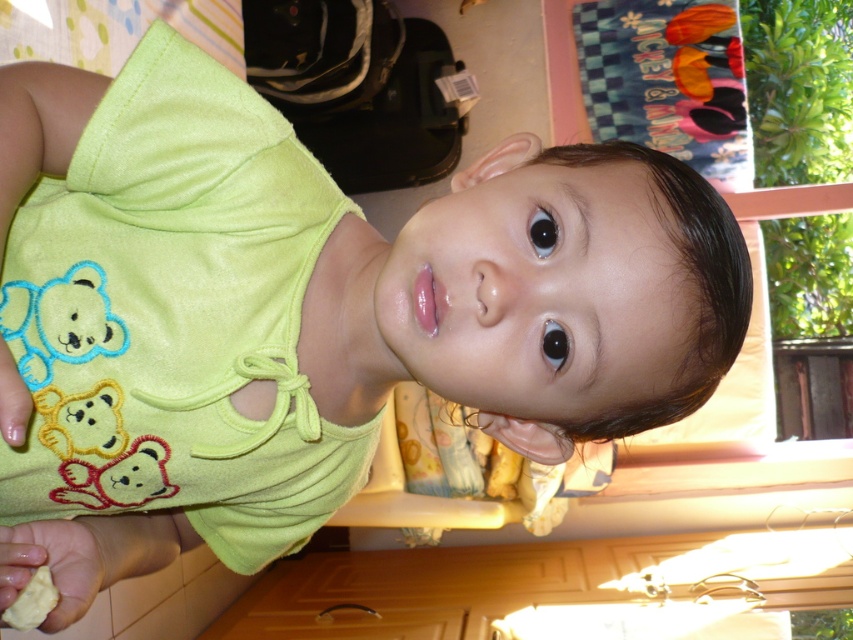
You are a parent trying to give your child a snack. You see the yellow matte cookie at lower left and the yellow matte food at lower left. Which one is closer to the wooden cabinet with a drawer and a handle?

The yellow matte cookie at lower left and the yellow matte food at lower left are both at the same location since they are both at lower left, so they are equally close to the wooden cabinet with a drawer and a handle.

You are a parent trying to give your child a snack. You see the yellow matte cookie at lower left and the yellow matte food at lower left. Which one is closer to the child?

The yellow matte cookie at lower left is closer to the child because the yellow matte food at lower left is behind it.